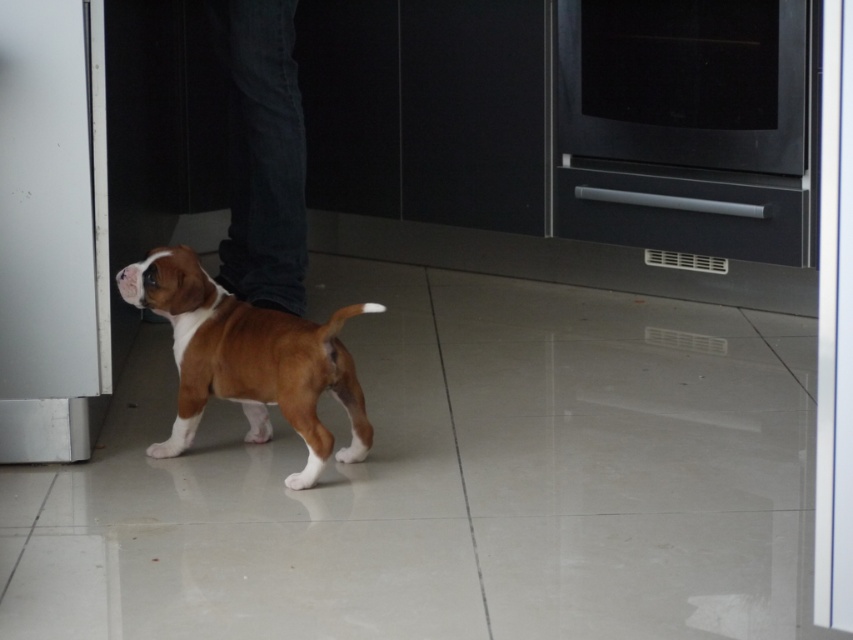
Does point (276, 317) lie in front of point (270, 52)?

Yes, it is in front of point (270, 52).

Does brown matte dog at center have a lesser width compared to dark blue jeans at center?

No, brown matte dog at center is not thinner than dark blue jeans at center.

Where is `brown matte dog at center`? This screenshot has height=640, width=853. brown matte dog at center is located at coordinates (248, 358).

From the picture: Is black matte oven at upper right below brown matte dog at center?

No, black matte oven at upper right is not below brown matte dog at center.

Does black matte oven at upper right appear over brown matte dog at center?

Indeed, black matte oven at upper right is positioned over brown matte dog at center.

Is point (585, 147) farther from viewer compared to point (329, 381)?

Yes, it is.

The image size is (853, 640). What are the coordinates of `black matte oven at upper right` in the screenshot? It's located at (683, 125).

This screenshot has height=640, width=853. What do you see at coordinates (683, 125) in the screenshot?
I see `black matte oven at upper right` at bounding box center [683, 125].

Who is positioned more to the left, black matte oven at upper right or dark blue jeans at center?

Positioned to the left is dark blue jeans at center.

Is point (561, 132) closer to camera compared to point (268, 61)?

No, (561, 132) is further to viewer.

The image size is (853, 640). What are the coordinates of `black matte oven at upper right` in the screenshot? It's located at (683, 125).